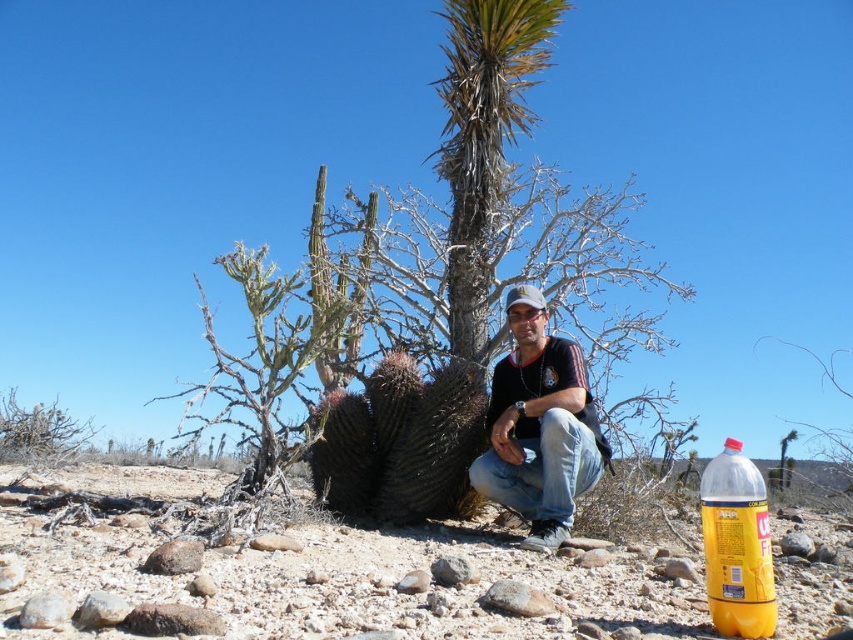
Which of these two, black cotton shirt at center or yellow translucent bottle at lower right, stands taller?

black cotton shirt at center is taller.

Who is more forward, (567,412) or (718,512)?

Positioned in front is point (718,512).

Does point (543, 333) come closer to viewer compared to point (730, 611)?

That is False.

Locate an element on the screen. The image size is (853, 640). black cotton shirt at center is located at coordinates (538, 426).

Can you confirm if brown textured cactus at center is positioned to the left of black cotton shirt at center?

In fact, brown textured cactus at center is to the right of black cotton shirt at center.

Is point (128, 522) positioned in front of point (514, 451)?

Yes.

Is point (421, 561) positioned in front of point (534, 547)?

That is True.

The height and width of the screenshot is (640, 853). Identify the location of brown textured cactus at center. (357, 582).

Is brown textured cactus at center smaller than green leafy palm tree at center?

Indeed, brown textured cactus at center has a smaller size compared to green leafy palm tree at center.

Is point (312, 572) more distant than point (457, 328)?

No, (312, 572) is in front of (457, 328).

Who is more distant from viewer, [173,483] or [476,269]?

Positioned behind is point [173,483].

The image size is (853, 640). Identify the location of brown textured cactus at center. (357, 582).